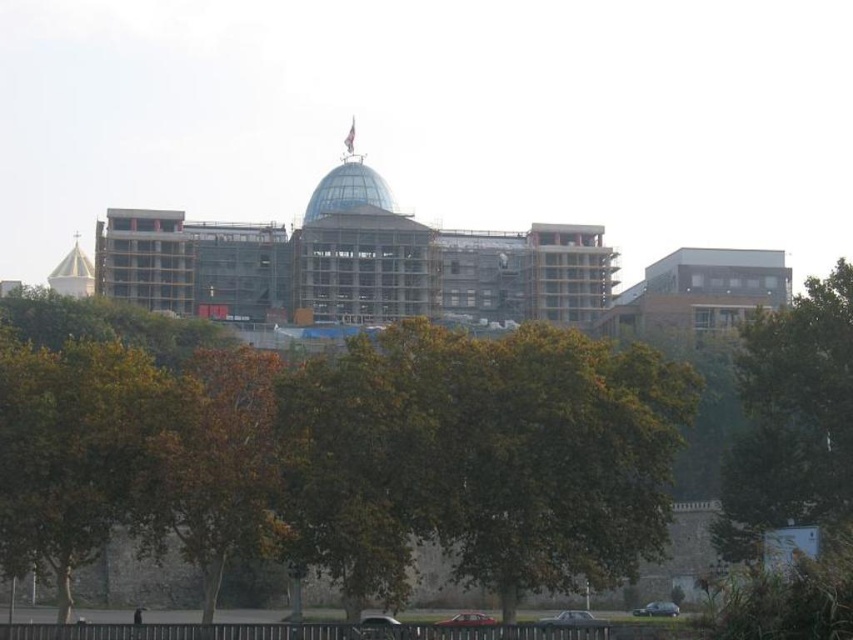
Does green leafy tree at lower left appear under brown leafy tree at center?

Incorrect, green leafy tree at lower left is not positioned below brown leafy tree at center.

Find the location of a particular element. The image size is (853, 640). green leafy tree at lower left is located at coordinates (80, 451).

At what (x,y) coordinates should I click in order to perform the action: click on green leafy tree at lower left. Please return your answer as a coordinate pair (x, y). The width and height of the screenshot is (853, 640). Looking at the image, I should click on (80, 451).

Between green leafy tree at right and brown leafy tree at center, which one has less height?

Standing shorter between the two is green leafy tree at right.

Can you confirm if green leafy tree at right is positioned above brown leafy tree at center?

Correct, green leafy tree at right is located above brown leafy tree at center.

This screenshot has width=853, height=640. What do you see at coordinates (791, 419) in the screenshot?
I see `green leafy tree at right` at bounding box center [791, 419].

Where is `green leafy tree at right`? green leafy tree at right is located at coordinates (791, 419).

Based on the photo, does green leafy tree at lower left lie in front of green leafy tree at right?

Yes, green leafy tree at lower left is closer to the viewer.

Does green leafy tree at lower left appear under green leafy tree at right?

Indeed, green leafy tree at lower left is positioned under green leafy tree at right.

Locate an element on the screen. The height and width of the screenshot is (640, 853). green leafy tree at lower left is located at coordinates (80, 451).